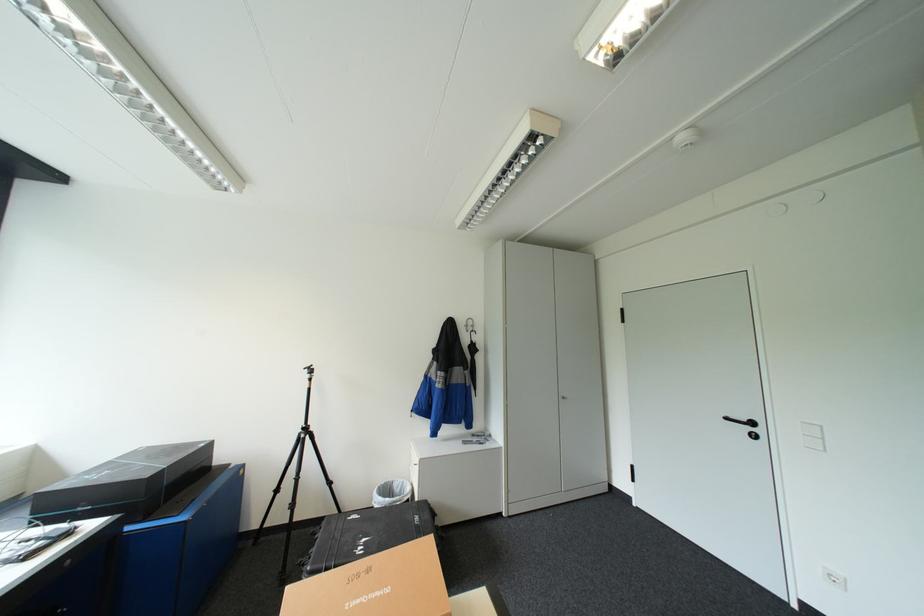
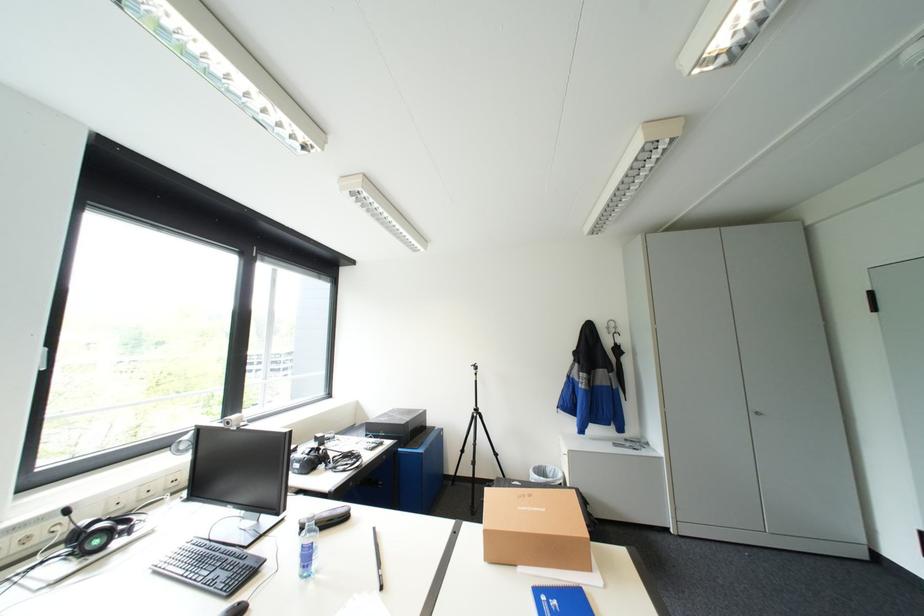
Question: The camera is either moving clockwise (left) or counter-clockwise (right) around the object. The first image is from the beginning of the video and the second image is from the end. Is the camera moving left or right when shooting the video?

Choices:
 (A) Left
 (B) Right

Answer: (B)